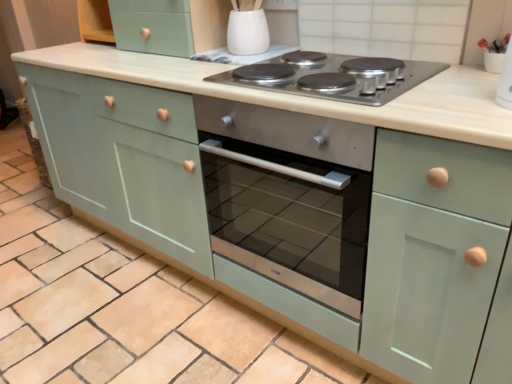
Where is `free region on the left part of white glossy vase at upper center`? free region on the left part of white glossy vase at upper center is located at coordinates (199, 59).